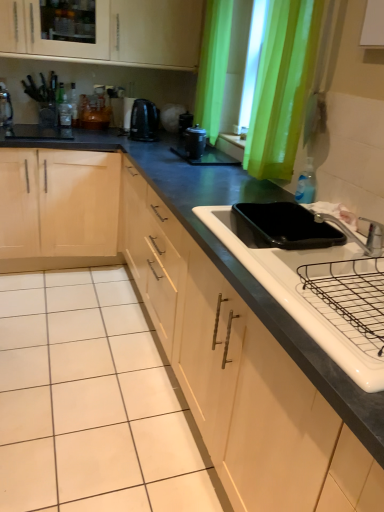
Where is `vacant space behind black matte pizza pan at sink`? vacant space behind black matte pizza pan at sink is located at coordinates (253, 193).